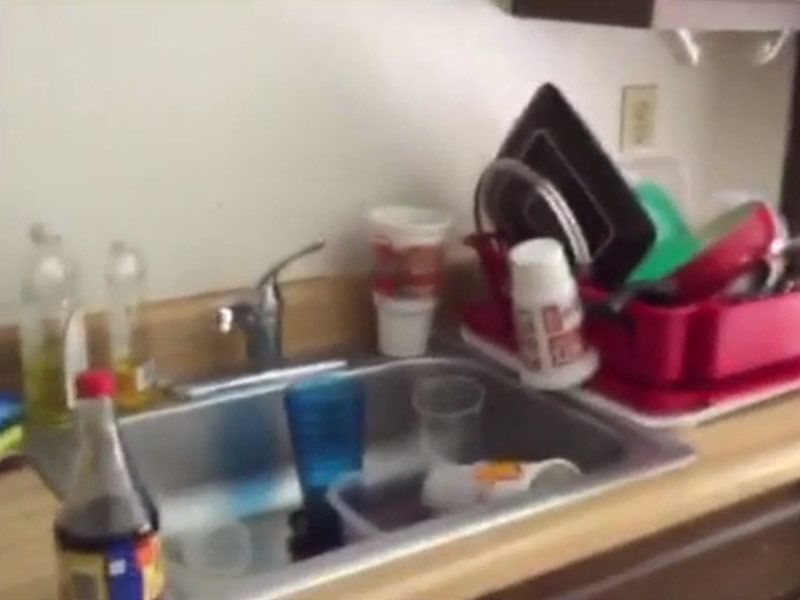
At what (x,y) coordinates should I click in order to perform the action: click on glass skillet lid. Please return your answer as a coordinate pair (x, y). Looking at the image, I should click on (522, 202).